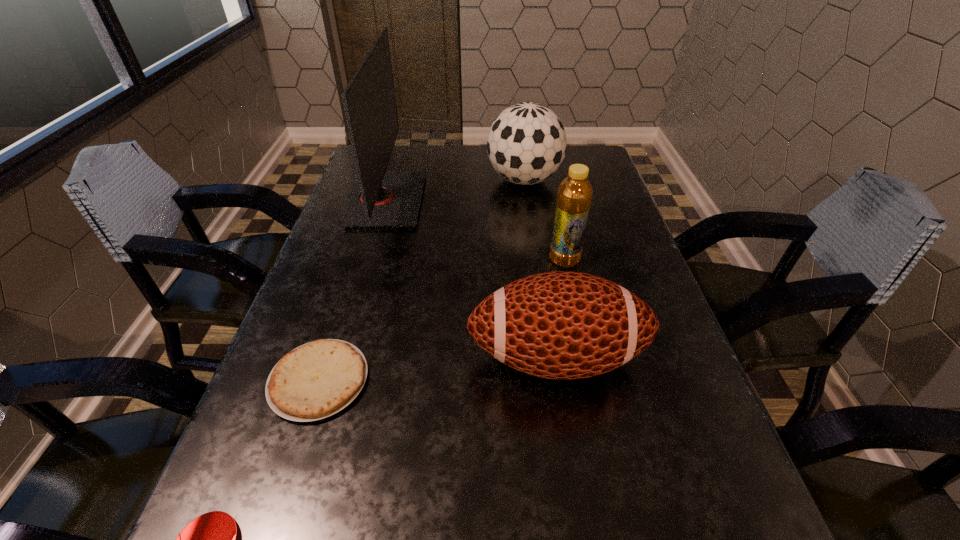
The image size is (960, 540). I want to click on vacant area in the image that satisfies the following two spatial constraints: 1. on the screen side of the football; 2. on the left side of the tallest object, so click(339, 358).

This screenshot has width=960, height=540. I want to click on free location that satisfies the following two spatial constraints: 1. on the screen side of the monitor; 2. on the back side of the football, so click(x=339, y=358).

The width and height of the screenshot is (960, 540). In order to click on free space in the image that satisfies the following two spatial constraints: 1. on the back side of the bottle; 2. on the right side of the football in this screenshot , I will do `click(540, 260)`.

Identify the location of free point that satisfies the following two spatial constraints: 1. on the front side of the football; 2. on the left side of the soccer ball. The image size is (960, 540). (550, 358).